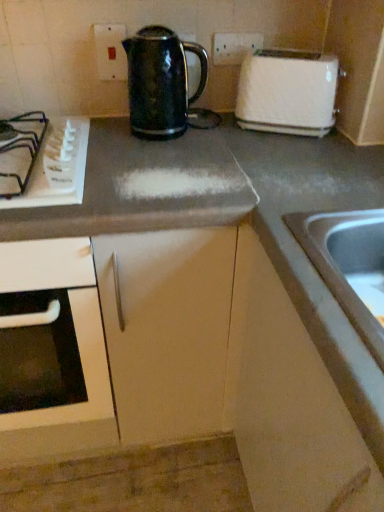
Identify the location of vacant area that is in front of white plastic toaster at upper right. pos(293,154).